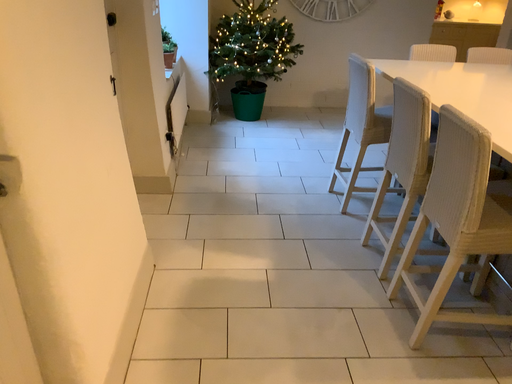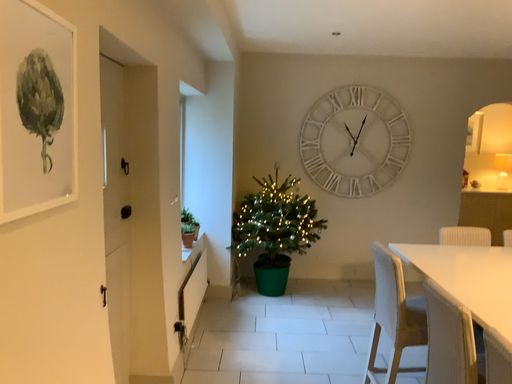
Question: How did the camera likely rotate when shooting the video?

Choices:
 (A) rotated downward
 (B) rotated upward

Answer: (B)